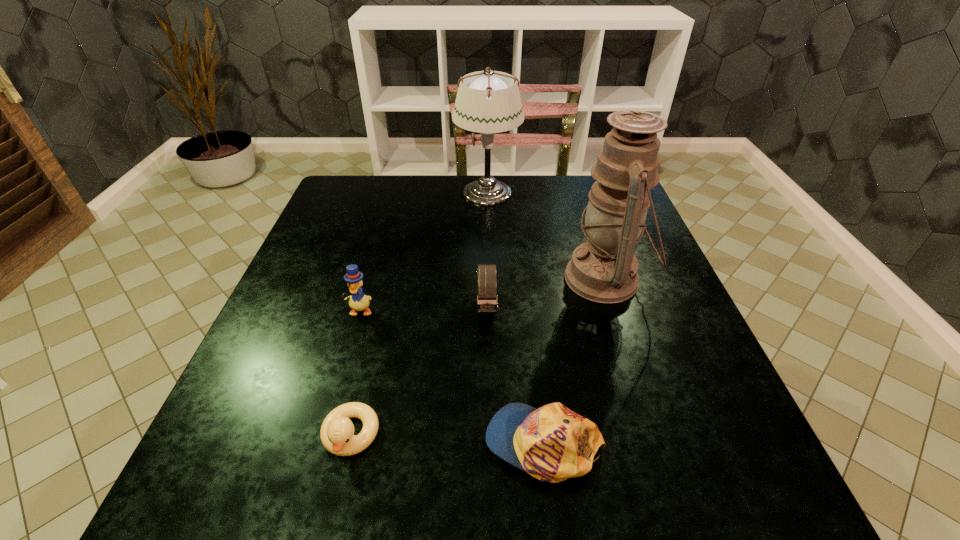
Where is `oil lamp`? Image resolution: width=960 pixels, height=540 pixels. oil lamp is located at coordinates (604, 269).

Where is `lampshade`? The image size is (960, 540). lampshade is located at coordinates (488, 102).

What are the coordinates of `the taller duckling` in the screenshot? It's located at (358, 301).

Image resolution: width=960 pixels, height=540 pixels. I want to click on watch, so click(x=487, y=303).

Locate an element on the screen. cap is located at coordinates (552, 443).

Find the location of `the nearer duckling`. the nearer duckling is located at coordinates coord(337,435).

This screenshot has height=540, width=960. I want to click on free space located 0.190m on the back of the oil lamp, so click(581, 205).

Find the location of a particular element. vacant space located 0.180m on the lampshade of the farthest object is located at coordinates (393, 192).

At what (x,y) coordinates should I click in order to perform the action: click on blank space located 0.140m on the lampshade of the farthest object. Please return your answer as a coordinate pair (x, y). This screenshot has width=960, height=540. Looking at the image, I should click on (407, 192).

Where is `vacant region located on the lampshade of the farthest object`? The height and width of the screenshot is (540, 960). vacant region located on the lampshade of the farthest object is located at coordinates (417, 192).